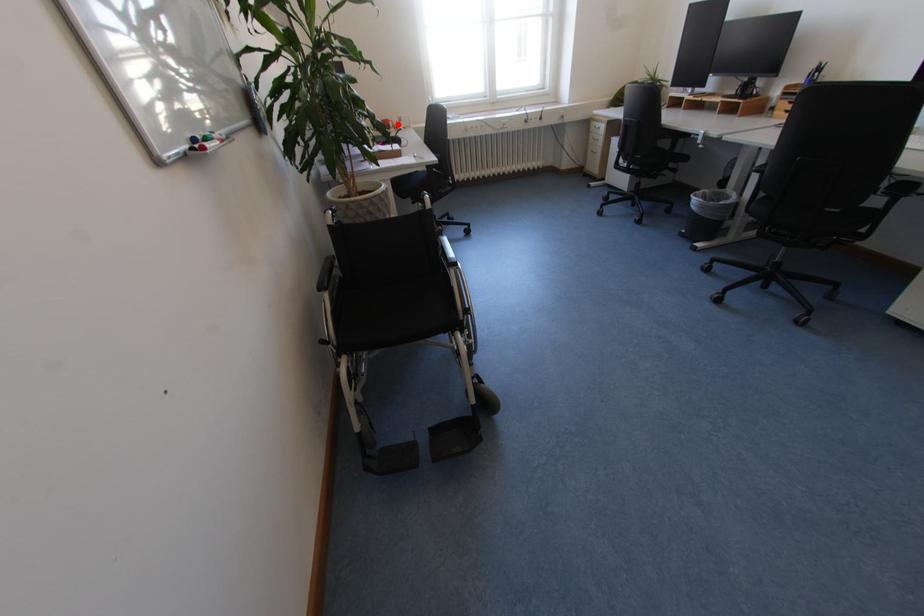
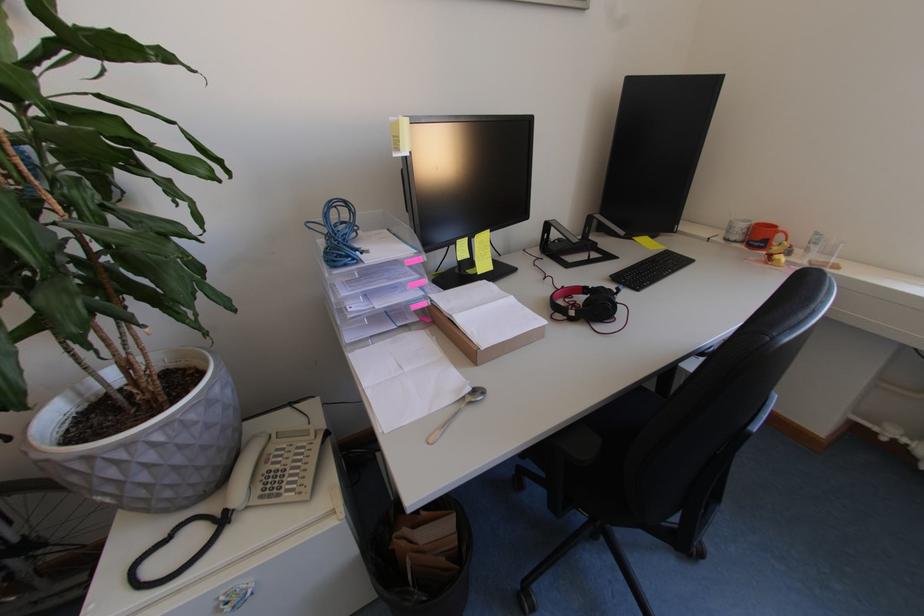
Question: A red point is marked in image1. In image2, is the corresponding 3D point closer to the camera or farther? Reply with the corresponding letter.

Choices:
 (A) The corresponding 3D point is closer.
 (B) The corresponding 3D point is farther.

Answer: (B)